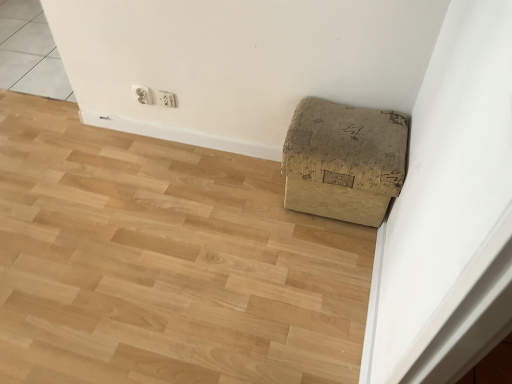
Locate an element on the screen. free space in front of brown cardboard box at lower right is located at coordinates (320, 263).